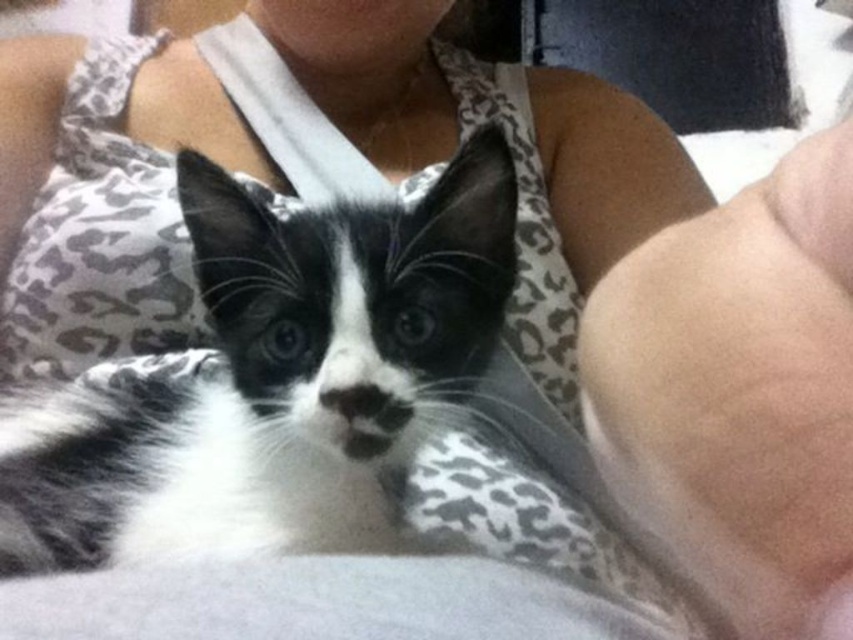
You are a photographer trying to capture a closeup of the black and white fur cat at center and the skinny white skin at lower right. Which one is closer to the camera?

The black and white fur cat at center is closer to the camera because the skinny white skin at lower right is behind it.

You are a photographer trying to capture a closeup of the black and white fur cat at center and the skinny white skin at lower right. Which subject is wider in the image?

The black and white fur cat at center is wider than the skinny white skin at lower right.